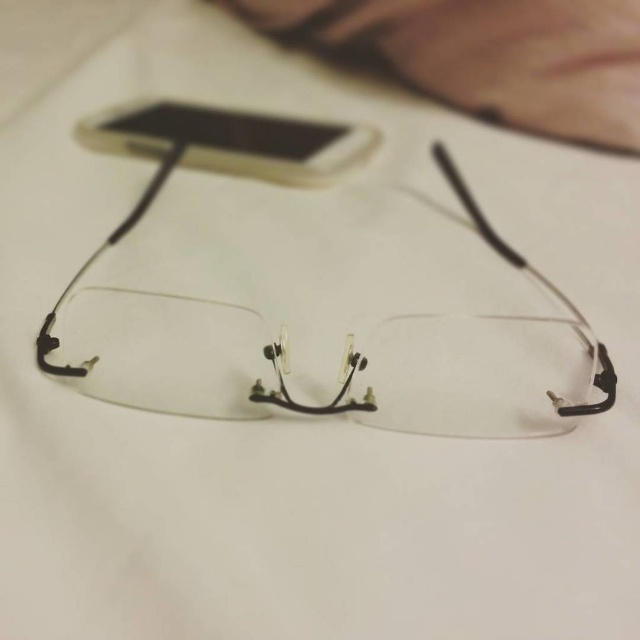
Question: Which point appears closest to the camera in this image?

Choices:
 (A) (108, 333)
 (B) (177, 134)

Answer: (A)

Question: Which of the following is the closest to the observer?

Choices:
 (A) (355, 161)
 (B) (518, 368)

Answer: (B)

Question: Does clear plastic glasses at center have a greater width compared to white plastic phone at upper center?

Choices:
 (A) yes
 (B) no

Answer: (A)

Question: Does clear plastic glasses at center appear on the right side of white plastic phone at upper center?

Choices:
 (A) yes
 (B) no

Answer: (A)

Question: In this image, where is clear plastic glasses at center located relative to white plastic phone at upper center?

Choices:
 (A) above
 (B) below

Answer: (B)